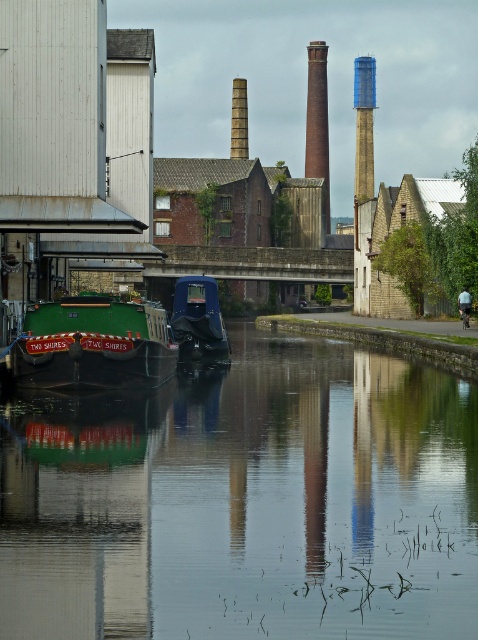
Does red brick chimney at center have a greater width compared to smooth brick chimney at center?

Correct, the width of red brick chimney at center exceeds that of smooth brick chimney at center.

Who is more distant from viewer, [326,227] or [230,120]?

The point [230,120] is behind.

Between point (316, 172) and point (231, 154), which one is positioned behind?

The point (316, 172) is more distant.

Locate an element on the screen. The height and width of the screenshot is (640, 478). red brick chimney at center is located at coordinates (317, 120).

Is green rubber boat at center smaller than red brick chimney at center?

Yes, green rubber boat at center is smaller than red brick chimney at center.

Is green rubber boat at center positioned before red brick chimney at center?

Yes.

Is point (151, 572) farther from viewer compared to point (325, 188)?

No, (151, 572) is closer to viewer.

You are a GUI agent. You are given a task and a screenshot of the screen. Output one action in this format:
    pyautogui.click(x=<x>, y=<y>)
    Task: Click on the green rubber boat at center
    
    Given the screenshot: What is the action you would take?
    pyautogui.click(x=246, y=502)

Is red brick chimney at center thinner than blue painted brick chimney at center?

Yes, red brick chimney at center is thinner than blue painted brick chimney at center.

Does red brick chimney at center have a larger size compared to blue painted brick chimney at center?

No.

Locate an element on the screen. The height and width of the screenshot is (640, 478). red brick chimney at center is located at coordinates (317, 120).